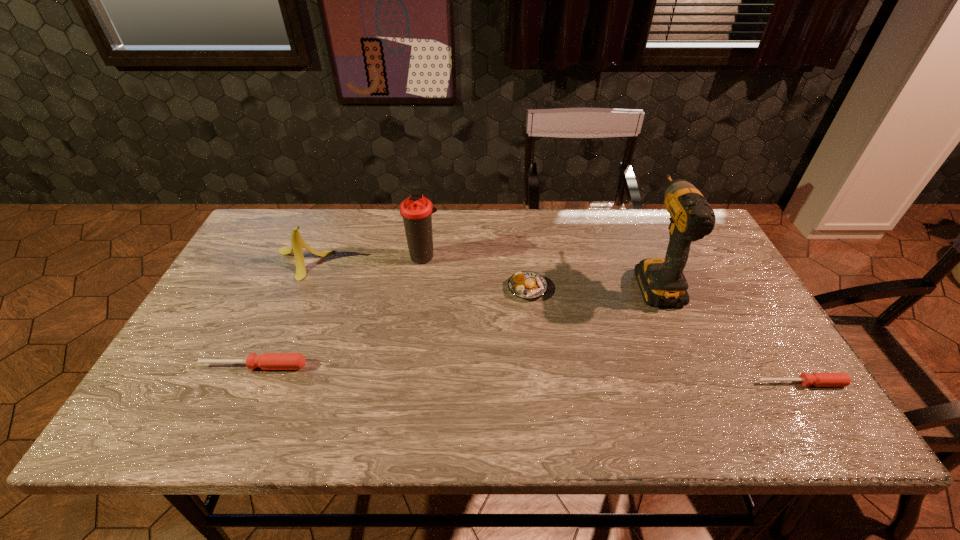
Please point a space for a new screwdriver to maintain equal intervals. Please provide its 2D coordinates. Your answer should be formatted as a tuple, i.e. [(x, y)], where the tuple contains the x and y coordinates of a point satisfying the conditions above.

[(523, 374)]